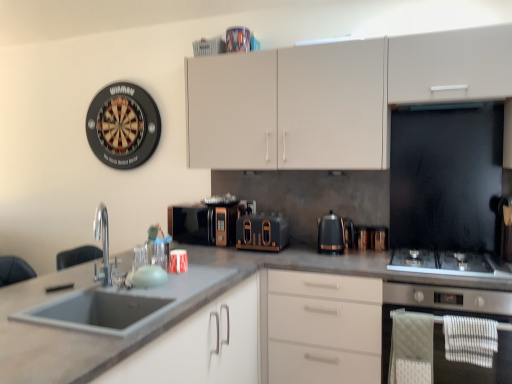
This screenshot has width=512, height=384. What are the coordinates of `free space in front of metallic silver kettle at center, which is the first appliance from right to left` in the screenshot? It's located at (382, 250).